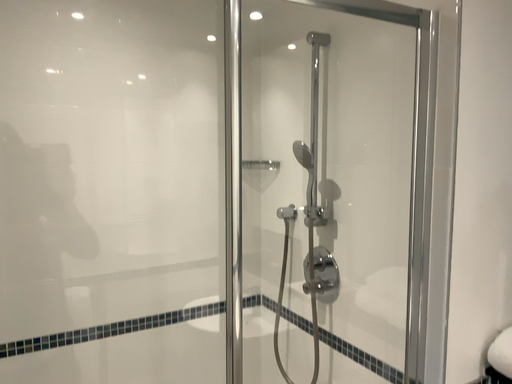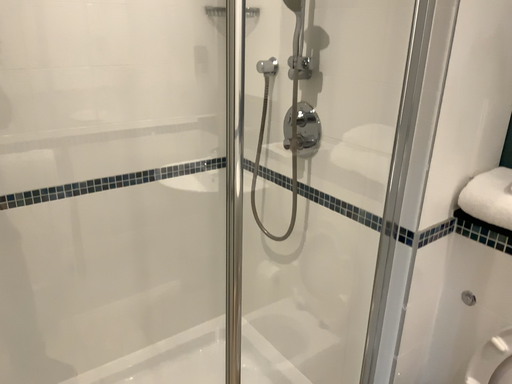
Question: How did the camera likely rotate when shooting the video?

Choices:
 (A) rotated downward
 (B) rotated upward

Answer: (A)